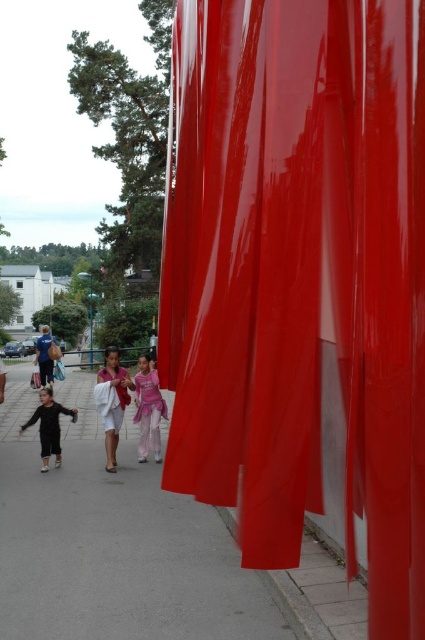
Question: Estimate the real-world distances between objects in this image. Which object is closer to the white cotton shirt at center?

Choices:
 (A) matte black dress at lower left
 (B) matte blue jeans at left
 (C) glossy plastic curtain at right

Answer: (A)

Question: Is glossy plastic curtain at right to the right of matte black dress at lower left from the viewer's perspective?

Choices:
 (A) yes
 (B) no

Answer: (A)

Question: Considering the relative positions of smooth concrete pavement at lower center and white cotton dress at center in the image provided, where is smooth concrete pavement at lower center located with respect to white cotton dress at center?

Choices:
 (A) left
 (B) right

Answer: (A)

Question: Considering the real-world distances, which object is closest to the white cotton dress at center?

Choices:
 (A) white cotton shirt at center
 (B) glossy plastic curtain at right
 (C) pink satin dress at center

Answer: (A)

Question: Is pink satin dress at center below matte blue jeans at left?

Choices:
 (A) no
 (B) yes

Answer: (B)

Question: Which point appears closest to the camera in this image?

Choices:
 (A) (39, 371)
 (B) (410, 476)

Answer: (B)